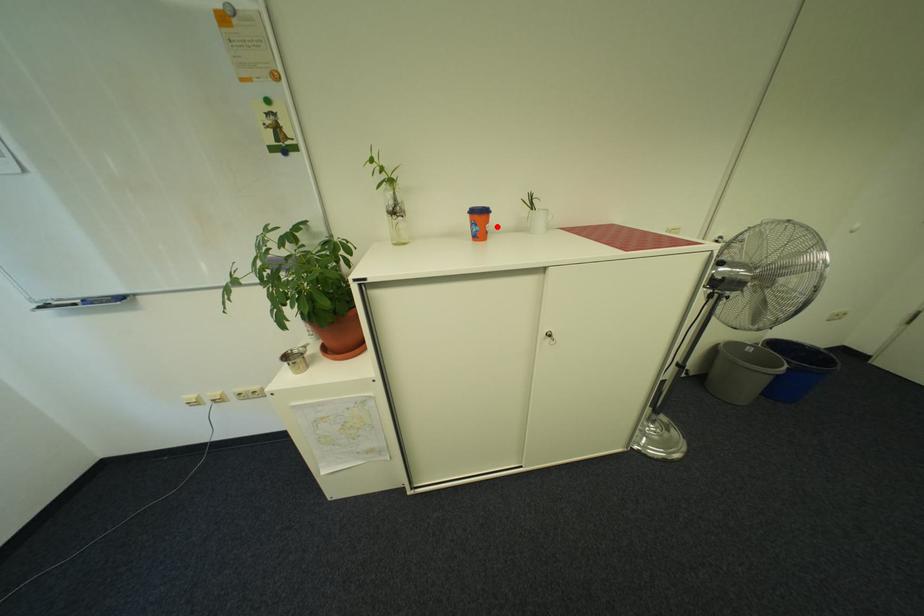
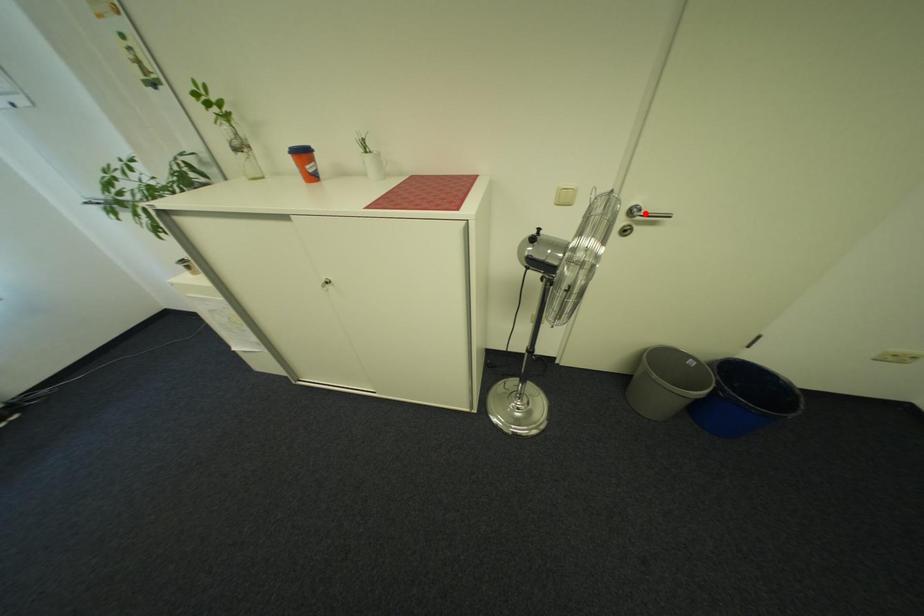
I am providing you with two images of the same scene from different viewpoints. A red point is marked on the first image and another point is marked on the second image. Are the points marked in image1 and image2 representing the same 3D position?

No